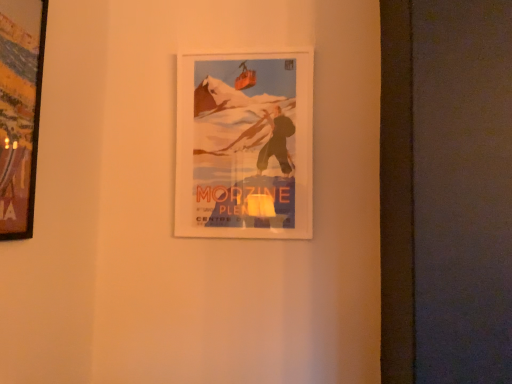
The width and height of the screenshot is (512, 384). What do you see at coordinates (20, 111) in the screenshot?
I see `wooden frame at left, the 1th picture frame positioned from the left` at bounding box center [20, 111].

Locate an element on the screen. This screenshot has height=384, width=512. wooden frame at left, acting as the first picture frame starting from the front is located at coordinates [20, 111].

At what (x,y) coordinates should I click in order to perform the action: click on matte paper poster at center, arranged as the second picture frame when viewed from the left. Please return your answer as a coordinate pair (x, y). This screenshot has width=512, height=384. Looking at the image, I should click on (245, 144).

This screenshot has height=384, width=512. What do you see at coordinates (245, 144) in the screenshot?
I see `matte paper poster at center, arranged as the second picture frame when viewed from the left` at bounding box center [245, 144].

Where is `wooden frame at left, acting as the first picture frame starting from the front`? wooden frame at left, acting as the first picture frame starting from the front is located at coordinates (20, 111).

Is matte paper poster at center, which appears as the first picture frame when viewed from the back, to the left of wooden frame at left, which is counted as the 2th picture frame, starting from the right, from the viewer's perspective?

In fact, matte paper poster at center, which appears as the first picture frame when viewed from the back, is to the right of wooden frame at left, which is counted as the 2th picture frame, starting from the right.

In the image, is matte paper poster at center, arranged as the second picture frame when viewed from the left, positioned in front of or behind wooden frame at left, which is counted as the second picture frame, starting from the back?

Clearly, matte paper poster at center, arranged as the second picture frame when viewed from the left, is behind wooden frame at left, which is counted as the second picture frame, starting from the back.

Considering the positions of point (312, 132) and point (0, 212), is point (312, 132) closer or farther from the camera than point (0, 212)?

Point (312, 132) is positioned farther from the camera compared to point (0, 212).

From the image's perspective, is matte paper poster at center, which appears as the first picture frame when viewed from the back, positioned above or below wooden frame at left, acting as the first picture frame starting from the front?

matte paper poster at center, which appears as the first picture frame when viewed from the back, is situated lower than wooden frame at left, acting as the first picture frame starting from the front, in the image.

From a real-world perspective, is matte paper poster at center, the 2th picture frame viewed from the front, beneath wooden frame at left, which is counted as the second picture frame, starting from the back?

Actually, matte paper poster at center, the 2th picture frame viewed from the front, is physically above wooden frame at left, which is counted as the second picture frame, starting from the back, in the real world.

Between matte paper poster at center, the first picture frame from the right, and wooden frame at left, acting as the first picture frame starting from the front, which one has larger width?

With larger width is wooden frame at left, acting as the first picture frame starting from the front.

Consider the image. Considering the relative sizes of matte paper poster at center, arranged as the second picture frame when viewed from the left, and wooden frame at left, the 1th picture frame positioned from the left, in the image provided, is matte paper poster at center, arranged as the second picture frame when viewed from the left, taller than wooden frame at left, the 1th picture frame positioned from the left,?

Indeed, matte paper poster at center, arranged as the second picture frame when viewed from the left, has a greater height compared to wooden frame at left, the 1th picture frame positioned from the left.

From the picture: Does matte paper poster at center, the first picture frame from the right, have a larger size compared to wooden frame at left, which is counted as the 2th picture frame, starting from the right?

Indeed, matte paper poster at center, the first picture frame from the right, has a larger size compared to wooden frame at left, which is counted as the 2th picture frame, starting from the right.

Is matte paper poster at center, which appears as the first picture frame when viewed from the back, located outside wooden frame at left, which is counted as the 2th picture frame, starting from the right?

Yes, matte paper poster at center, which appears as the first picture frame when viewed from the back, is not within wooden frame at left, which is counted as the 2th picture frame, starting from the right.

From the picture: Is matte paper poster at center, which appears as the first picture frame when viewed from the back, not near wooden frame at left, which is counted as the 2th picture frame, starting from the right?

No, matte paper poster at center, which appears as the first picture frame when viewed from the back, is not far away from wooden frame at left, which is counted as the 2th picture frame, starting from the right.

Consider the image. Does matte paper poster at center, the 2th picture frame viewed from the front, turn towards wooden frame at left, which is counted as the 2th picture frame, starting from the right?

No.

From the picture: Measure the distance between matte paper poster at center, the 2th picture frame viewed from the front, and wooden frame at left, which is counted as the second picture frame, starting from the back.

A distance of 68.47 centimeters exists between matte paper poster at center, the 2th picture frame viewed from the front, and wooden frame at left, which is counted as the second picture frame, starting from the back.

Locate an element on the screen. picture frame to the right of wooden frame at left, the 1th picture frame positioned from the left is located at coordinates (245, 144).

Considering the positions of objects wooden frame at left, which is counted as the second picture frame, starting from the back, and matte paper poster at center, arranged as the second picture frame when viewed from the left, in the image provided, who is more to the left, wooden frame at left, which is counted as the second picture frame, starting from the back, or matte paper poster at center, arranged as the second picture frame when viewed from the left,?

wooden frame at left, which is counted as the second picture frame, starting from the back.

Between wooden frame at left, which is counted as the second picture frame, starting from the back, and matte paper poster at center, arranged as the second picture frame when viewed from the left, which one is positioned in front?

wooden frame at left, which is counted as the second picture frame, starting from the back, is more forward.

Considering the points (35, 112) and (287, 225), which point is in front, point (35, 112) or point (287, 225)?

Point (35, 112)

From the image's perspective, which is below, wooden frame at left, which is counted as the 2th picture frame, starting from the right, or matte paper poster at center, the first picture frame from the right?

matte paper poster at center, the first picture frame from the right.

From a real-world perspective, is wooden frame at left, acting as the first picture frame starting from the front, positioned under matte paper poster at center, the first picture frame from the right, based on gravity?

Yes.

Which of these two, wooden frame at left, which is counted as the 2th picture frame, starting from the right, or matte paper poster at center, the first picture frame from the right, is thinner?

Thinner between the two is matte paper poster at center, the first picture frame from the right.

Between wooden frame at left, acting as the first picture frame starting from the front, and matte paper poster at center, the 2th picture frame viewed from the front, which one has more height?

matte paper poster at center, the 2th picture frame viewed from the front, is taller.

Considering the sizes of wooden frame at left, the 1th picture frame positioned from the left, and matte paper poster at center, the first picture frame from the right, in the image, is wooden frame at left, the 1th picture frame positioned from the left, bigger or smaller than matte paper poster at center, the first picture frame from the right,?

Considering their sizes, wooden frame at left, the 1th picture frame positioned from the left, takes up less space than matte paper poster at center, the first picture frame from the right.

Can matte paper poster at center, the 2th picture frame viewed from the front, be found inside wooden frame at left, the 1th picture frame positioned from the left?

Actually, matte paper poster at center, the 2th picture frame viewed from the front, is outside wooden frame at left, the 1th picture frame positioned from the left.

Is the surface of wooden frame at left, which is counted as the second picture frame, starting from the back, in direct contact with matte paper poster at center, arranged as the second picture frame when viewed from the left?

No, wooden frame at left, which is counted as the second picture frame, starting from the back, is not in contact with matte paper poster at center, arranged as the second picture frame when viewed from the left.

Is wooden frame at left, the 1th picture frame positioned from the left, facing towards matte paper poster at center, the 2th picture frame viewed from the front?

No, wooden frame at left, the 1th picture frame positioned from the left, does not turn towards matte paper poster at center, the 2th picture frame viewed from the front.

How many degrees apart are the facing directions of wooden frame at left, the 1th picture frame positioned from the left, and matte paper poster at center, which appears as the first picture frame when viewed from the back?

The angle between the facing direction of wooden frame at left, the 1th picture frame positioned from the left, and the facing direction of matte paper poster at center, which appears as the first picture frame when viewed from the back, is 90.8 degrees.

Locate an element on the screen. Image resolution: width=512 pixels, height=384 pixels. picture frame behind the wooden frame at left, which is counted as the second picture frame, starting from the back is located at coordinates (245, 144).

Where is `picture frame below the wooden frame at left, which is counted as the second picture frame, starting from the back (from the image's perspective)`? Image resolution: width=512 pixels, height=384 pixels. picture frame below the wooden frame at left, which is counted as the second picture frame, starting from the back (from the image's perspective) is located at coordinates (245, 144).

The width and height of the screenshot is (512, 384). I want to click on picture frame on the left of matte paper poster at center, arranged as the second picture frame when viewed from the left, so click(20, 111).